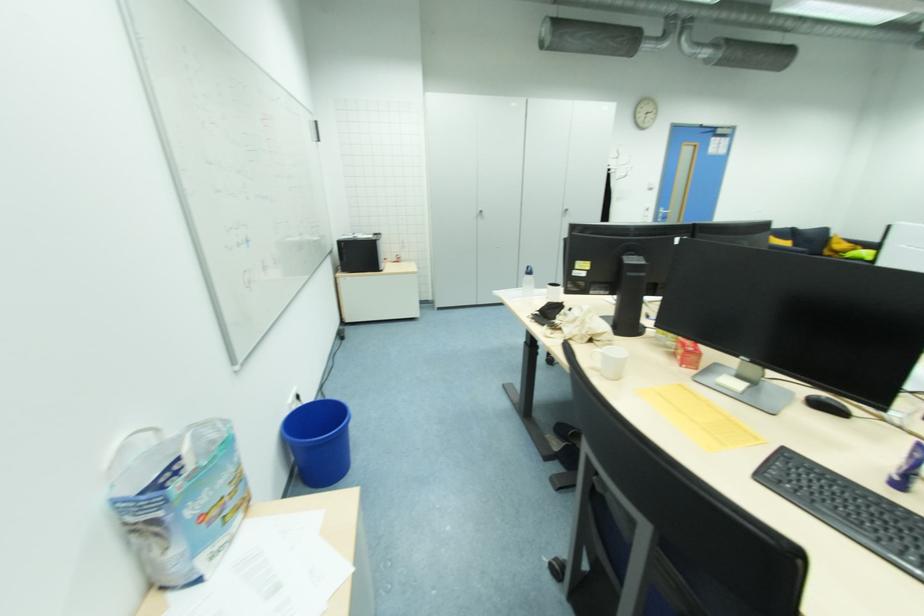
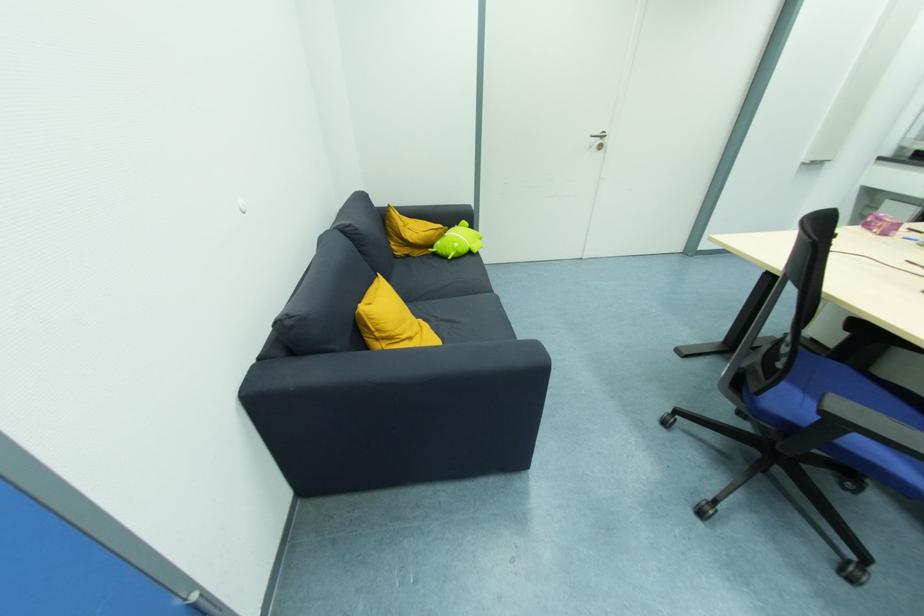
In the second image, find the point that corresponds to [828,254] in the first image.

(403, 253)